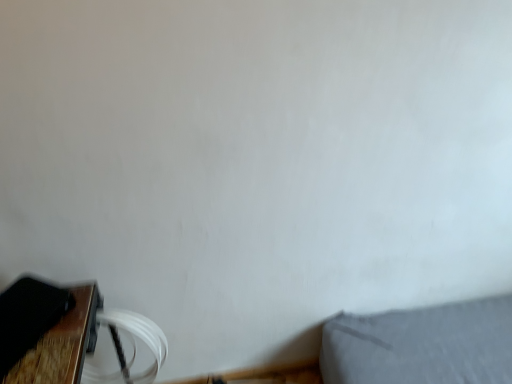
This screenshot has width=512, height=384. Identify the location of black wood table at lower left. point(62,343).

What do you see at coordinates (62, 343) in the screenshot? I see `black wood table at lower left` at bounding box center [62, 343].

You are a GUI agent. You are given a task and a screenshot of the screen. Output one action in this format:
    pyautogui.click(x=<x>, y=<y>)
    Task: Click on the black wood table at lower left
    This screenshot has height=384, width=512.
    Given the screenshot: What is the action you would take?
    pyautogui.click(x=62, y=343)